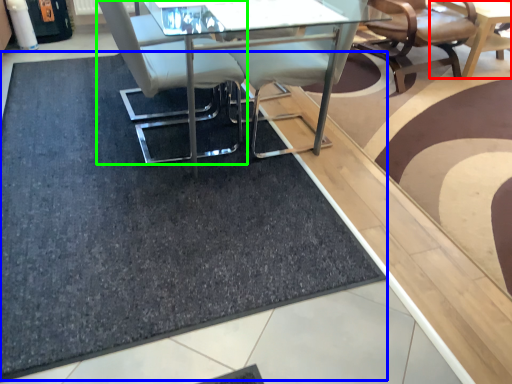
Question: Estimate the real-world distances between objects in this image. Which object is farther from table (highlighted by a red box), doormat (highlighted by a blue box) or chair (highlighted by a green box)?

Choices:
 (A) doormat
 (B) chair

Answer: (A)